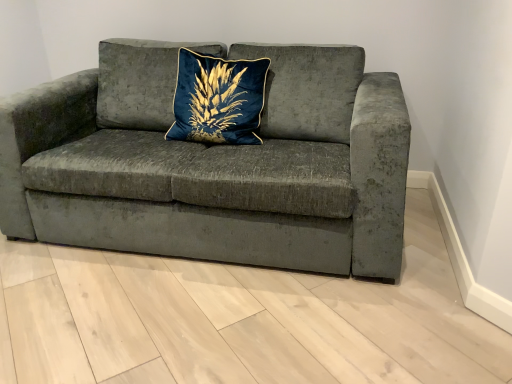
The width and height of the screenshot is (512, 384). I want to click on vacant space in front of velvet gray couch at center, so click(x=195, y=322).